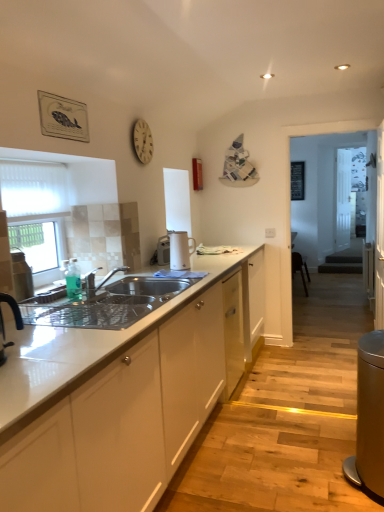
Question: From the image's perspective, is clear glass door at center, which is the first glass door in back-to-front order, located beneath transparent glass door at center, which is the 2th glass door from back to front?

Choices:
 (A) no
 (B) yes

Answer: (A)

Question: From the image's perspective, is clear glass door at center, which is the first glass door in back-to-front order, above transparent glass door at center, which appears as the first glass door when viewed from the front?

Choices:
 (A) no
 (B) yes

Answer: (B)

Question: From a real-world perspective, is clear glass door at center, which is the 2th glass door from front to back, positioned over transparent glass door at center, which appears as the first glass door when viewed from the front, based on gravity?

Choices:
 (A) no
 (B) yes

Answer: (B)

Question: Is clear glass door at center, which is the first glass door in back-to-front order, not close to transparent glass door at center, which appears as the first glass door when viewed from the front?

Choices:
 (A) no
 (B) yes

Answer: (A)

Question: From a real-world perspective, is clear glass door at center, which is the 2th glass door from front to back, located beneath transparent glass door at center, which is the 2th glass door from back to front?

Choices:
 (A) no
 (B) yes

Answer: (A)

Question: Is clear glass door at center, which is the first glass door in back-to-front order, positioned behind transparent glass door at center, which is the 2th glass door from back to front?

Choices:
 (A) yes
 (B) no

Answer: (A)

Question: From a real-world perspective, is clear glass door at center, which is the first glass door in back-to-front order, over white mesh screen at left?

Choices:
 (A) yes
 (B) no

Answer: (B)

Question: Is clear glass door at center, which is the 2th glass door from front to back, taller than white mesh screen at left?

Choices:
 (A) no
 (B) yes

Answer: (B)

Question: Is white mesh screen at left inside clear glass door at center, which is the first glass door in back-to-front order?

Choices:
 (A) yes
 (B) no

Answer: (B)

Question: Would you consider clear glass door at center, which is the 2th glass door from front to back, to be distant from white mesh screen at left?

Choices:
 (A) yes
 (B) no

Answer: (A)

Question: Does clear glass door at center, which is the first glass door in back-to-front order, have a larger size compared to white mesh screen at left?

Choices:
 (A) no
 (B) yes

Answer: (B)

Question: Could you tell me if clear glass door at center, which is the 2th glass door from front to back, is turned towards white mesh screen at left?

Choices:
 (A) no
 (B) yes

Answer: (A)

Question: Can you confirm if satin silver sink at center is taller than white mesh screen at left?

Choices:
 (A) yes
 (B) no

Answer: (B)